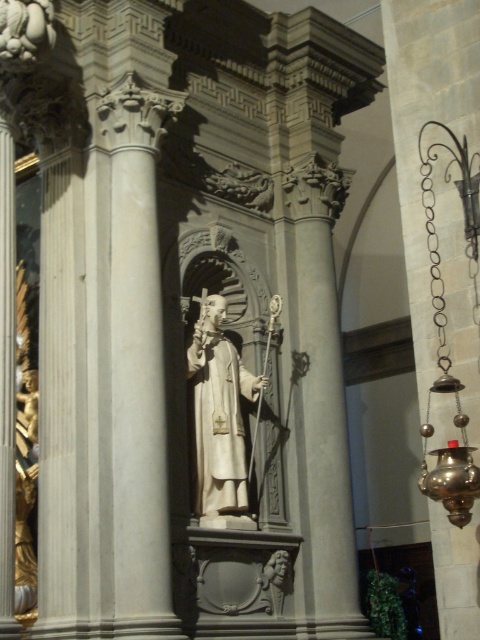
You are an architect designing a new church and want to replicate the layout of the statue and candle holder seen in the image. According to the scene, where should you place the polished brass candle holder at right relative to the white marble statue at center?

The polished brass candle holder at right should be placed to the right of the white marble statue at center as per the scene description.

You are standing in the cathedral and want to light the polished brass candle holder at right. Considering your arm length is 0.7 meters, can you reach it without moving?

The polished brass candle holder at right is 21.04 meters from viewer, which is much farther than your arm length of 0.7 meters. You cannot reach it without moving closer.

You are an interior designer planning to place a new decorative item in the church. You have a small golden bell that is 10 cm in width. You want to place it near the polished brass candle holder at right and the white marble statue at center. Which object can the bell fit next to without exceeding its width?

The small golden bell with 10 cm width can fit next to the white marble statue at center because the polished brass candle holder at right might be wider than the statue, making the statue a better fit for the bell.